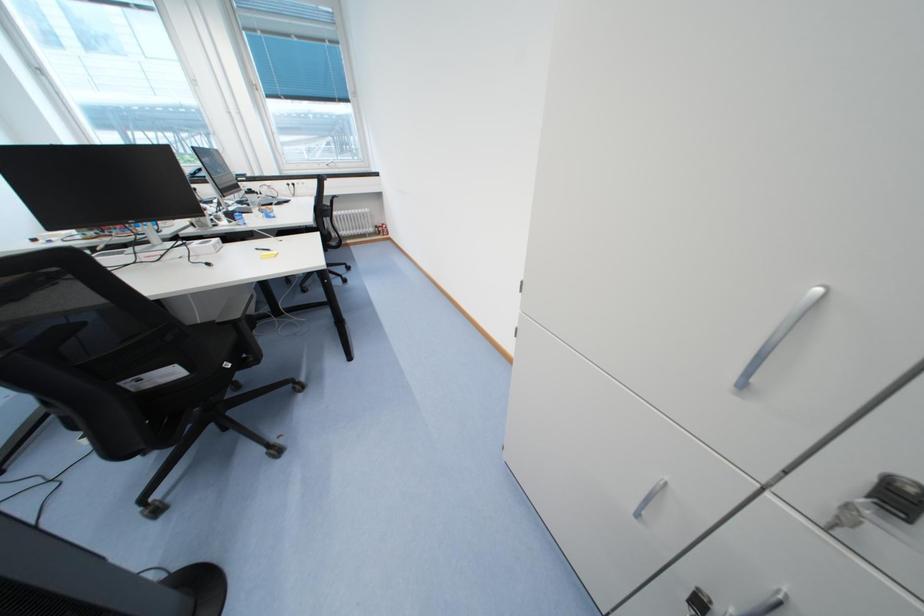
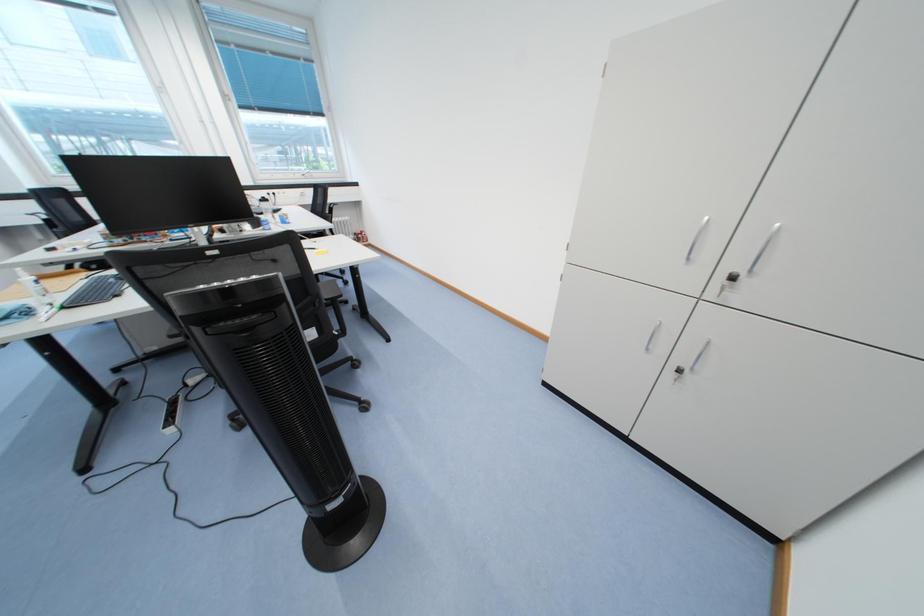
In a continuous first-person perspective shot, in which direction is the camera moving?

The cameraman moved toward left, backward.